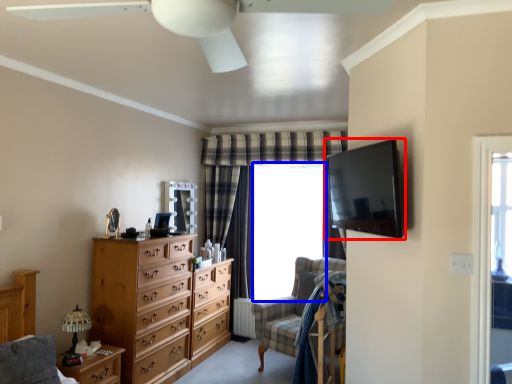
Question: Among these objects, which one is nearest to the camera, television (highlighted by a red box) or window screen (highlighted by a blue box)?

Choices:
 (A) television
 (B) window screen

Answer: (A)